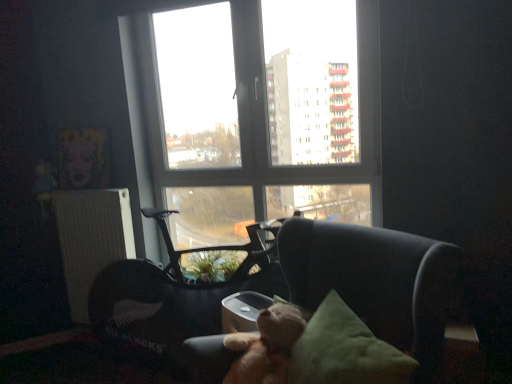
What do you see at coordinates (91, 238) in the screenshot? This screenshot has width=512, height=384. I see `white textured radiator at left` at bounding box center [91, 238].

The height and width of the screenshot is (384, 512). What are the coordinates of `transparent glass window at center` in the screenshot? It's located at (261, 113).

The image size is (512, 384). What are the coordinates of `black plastic swivel chair at center` in the screenshot? It's located at (179, 293).

What is the approximate height of dark gray leather chair at center?

98.32 centimeters.

Identify the location of white textured radiator at left. pos(91,238).

Which of these two, dark gray leather chair at center or light brown plush at center, is smaller?

With smaller size is light brown plush at center.

Is dark gray leather chair at center looking in the opposite direction of light brown plush at center?

No, dark gray leather chair at center is not facing the opposite direction of light brown plush at center.

Which is in front, dark gray leather chair at center or light brown plush at center?

dark gray leather chair at center.

Can we say dark gray leather chair at center lies outside light brown plush at center?

Yes, dark gray leather chair at center is located beyond the bounds of light brown plush at center.

From the picture: Is there a large distance between light brown plush at center and green fabric pillow at center?

No, light brown plush at center is not far from green fabric pillow at center.

What's the angular difference between light brown plush at center and green fabric pillow at center's facing directions?

The facing directions of light brown plush at center and green fabric pillow at center are 11.5 degrees apart.

Image resolution: width=512 pixels, height=384 pixels. Find the location of `pillow above the light brown plush at center (from a real-world perspective)`. pillow above the light brown plush at center (from a real-world perspective) is located at coordinates (345, 350).

Is light brown plush at center aimed at green fabric pillow at center?

No.

Consider the image. What's the angular difference between green fabric pillow at center and light brown plush at center's facing directions?

11.5 degrees.

Does green fabric pillow at center lie in front of light brown plush at center?

Yes, the depth of green fabric pillow at center is less than that of light brown plush at center.

Looking at the image, does green fabric pillow at center seem bigger or smaller compared to light brown plush at center?

Clearly, green fabric pillow at center is larger in size than light brown plush at center.

Between green fabric pillow at center and light brown plush at center, which one has larger width?

With larger width is green fabric pillow at center.

Would you say transparent glass window at center is inside or outside white textured radiator at left?

transparent glass window at center is not inside white textured radiator at left, it's outside.

You are a GUI agent. You are given a task and a screenshot of the screen. Output one action in this format:
    pyautogui.click(x=<x>, y=<y>)
    Task: Click on the window positioned vertically above the white textured radiator at left (from a real-world perspective)
    
    Given the screenshot: What is the action you would take?
    pyautogui.click(x=261, y=113)

Considering the sizes of transparent glass window at center and white textured radiator at left in the image, is transparent glass window at center taller or shorter than white textured radiator at left?

Considering their sizes, transparent glass window at center has more height than white textured radiator at left.

Would you consider transparent glass window at center to be distant from white textured radiator at left?

No.

Considering the points (319, 350) and (96, 193), which point is behind, point (319, 350) or point (96, 193)?

The point (96, 193) is farther.

From a real-world perspective, is green fabric pillow at center physically above white textured radiator at left?

No.

Is green fabric pillow at center not inside white textured radiator at left?

Yes, green fabric pillow at center is outside of white textured radiator at left.

Which is more to the left, green fabric pillow at center or white textured radiator at left?

Positioned to the left is white textured radiator at left.

Is transparent glass window at center situated inside green fabric pillow at center or outside?

transparent glass window at center is spatially situated outside green fabric pillow at center.

From a real-world perspective, does transparent glass window at center stand above green fabric pillow at center?

Yes, from a real-world perspective, transparent glass window at center is on top of green fabric pillow at center.

Measure the distance from transparent glass window at center to green fabric pillow at center.

transparent glass window at center and green fabric pillow at center are 3.99 feet apart.

Would you say black plastic swivel chair at center is outside transparent glass window at center?

black plastic swivel chair at center lies outside transparent glass window at center's area.

Find the location of `swivel chair in front of the transparent glass window at center`. swivel chair in front of the transparent glass window at center is located at coordinates (179, 293).

Does black plastic swivel chair at center come in front of transparent glass window at center?

Yes, black plastic swivel chair at center is closer to the viewer.

Looking at this image, from the image's perspective, is black plastic swivel chair at center above or below transparent glass window at center?

Based on their image positions, black plastic swivel chair at center is located beneath transparent glass window at center.

The image size is (512, 384). In order to click on chair on the right of light brown plush at center in this screenshot , I will do `click(378, 282)`.

The width and height of the screenshot is (512, 384). I want to click on teddy bear that is on the left side of green fabric pillow at center, so click(266, 346).

From the image, which object appears to be nearer to black plastic swivel chair at center, white textured radiator at left or transparent glass window at center?

white textured radiator at left lies closer to black plastic swivel chair at center than the other object.

Based on their spatial positions, is transparent glass window at center or dark gray leather chair at center closer to green fabric pillow at center?

dark gray leather chair at center is positioned closer to the anchor green fabric pillow at center.

From the image, which object appears to be farther from white textured radiator at left, dark gray leather chair at center or transparent glass window at center?

dark gray leather chair at center is positioned further to the anchor white textured radiator at left.

When comparing their distances from dark gray leather chair at center, does transparent glass window at center or green fabric pillow at center seem further?

Based on the image, transparent glass window at center appears to be further to dark gray leather chair at center.

Estimate the real-world distances between objects in this image. Which object is closer to black plastic swivel chair at center, light brown plush at center or dark gray leather chair at center?

light brown plush at center.

When comparing their distances from green fabric pillow at center, does white textured radiator at left or dark gray leather chair at center seem closer?

Based on the image, dark gray leather chair at center appears to be nearer to green fabric pillow at center.

From the image, which object appears to be nearer to white textured radiator at left, black plastic swivel chair at center or green fabric pillow at center?

The object closer to white textured radiator at left is black plastic swivel chair at center.

Estimate the real-world distances between objects in this image. Which object is further from transparent glass window at center, light brown plush at center or white textured radiator at left?

Among the two, light brown plush at center is located further to transparent glass window at center.

What are the coordinates of `teddy bear between green fabric pillow at center and black plastic swivel chair at center along the z-axis` in the screenshot? It's located at (266, 346).

Locate an element on the screen. pillow between dark gray leather chair at center and white textured radiator at left from front to back is located at coordinates (345, 350).

What are the coordinates of `swivel chair between green fabric pillow at center and white textured radiator at left in the front-back direction` in the screenshot? It's located at (179, 293).

Where is `pillow between transparent glass window at center and light brown plush at center in the up-down direction`? This screenshot has width=512, height=384. pillow between transparent glass window at center and light brown plush at center in the up-down direction is located at coordinates (345, 350).